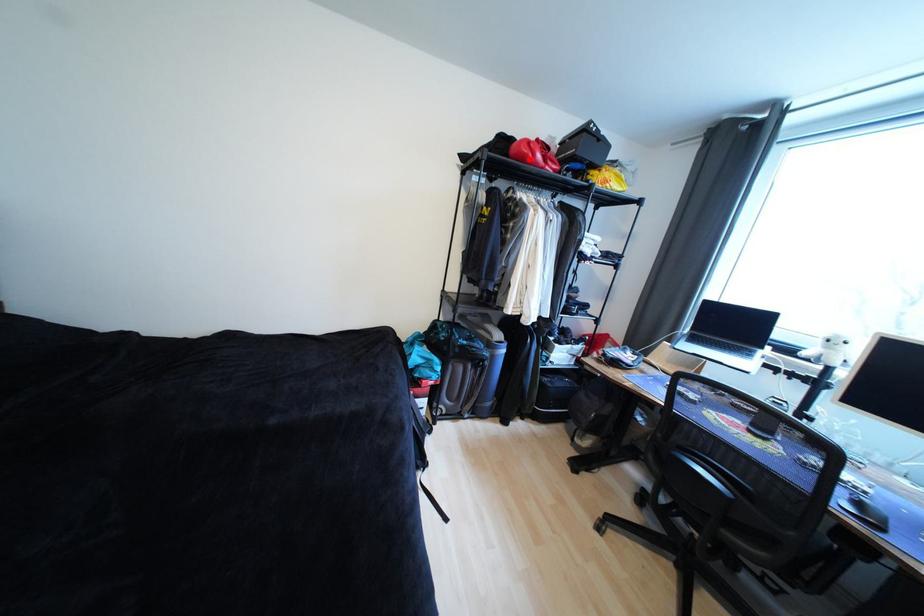
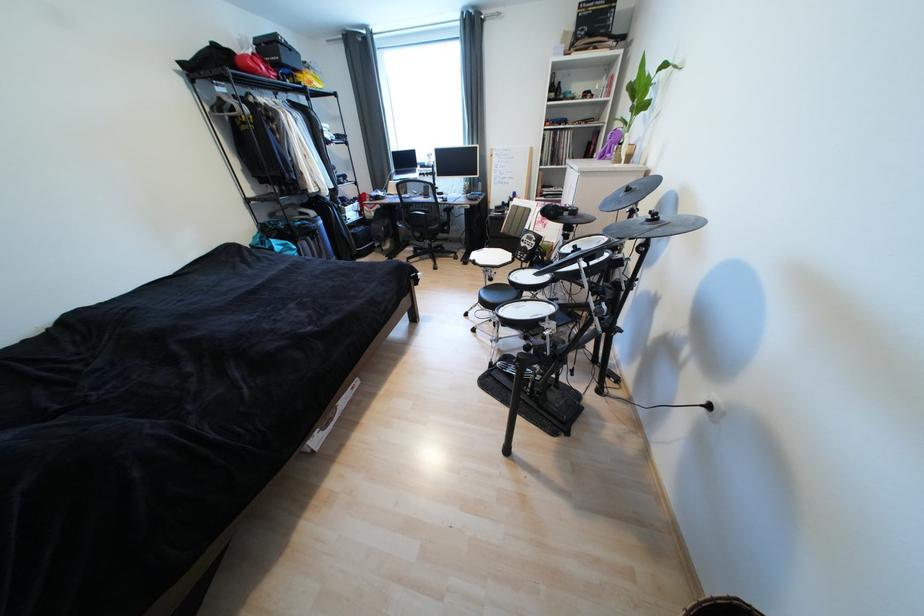
Where in the second image is the point corresponding to the highlighted location from the first image?

(261, 73)